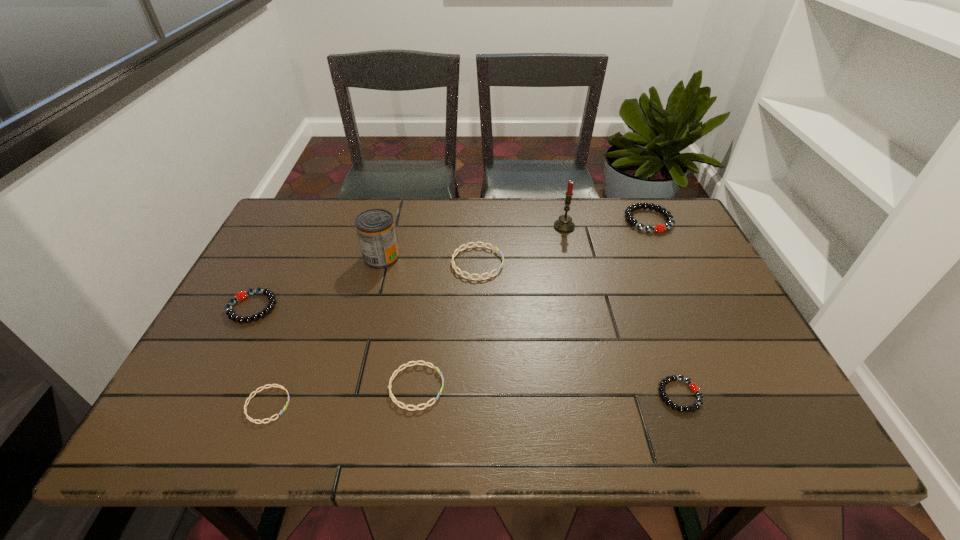
This screenshot has height=540, width=960. Identify the location of the second smallest blue bracelet. (394, 400).

Where is `the smallest black bracelet`? The height and width of the screenshot is (540, 960). the smallest black bracelet is located at coordinates (696, 406).

This screenshot has width=960, height=540. Identify the location of the second bracelet from left to right. (271, 385).

At what (x,y) coordinates should I click in order to perform the action: click on the shortest bracelet. Please return your answer as a coordinate pair (x, y). Looking at the image, I should click on (271, 385).

What are the coordinates of `vacant space positioned 0.340m on the left of the candle` in the screenshot? It's located at (444, 227).

Find the location of `vacant area situated on the front of the third object from left to right`. vacant area situated on the front of the third object from left to right is located at coordinates 352,375.

Where is `vacant space located 0.250m on the front of the farthest bracelet`? The image size is (960, 540). vacant space located 0.250m on the front of the farthest bracelet is located at coordinates (683, 292).

The width and height of the screenshot is (960, 540). What are the coordinates of `vacant space located on the surface of the farthest blue bracelet showing star-shaped elements` in the screenshot? It's located at (631, 263).

Identify the location of vacant area situated on the back of the fifth farthest object. (298, 220).

I want to click on vacant point located on the surface of the second smallest blue bracelet showing star-shaped elements, so click(545, 387).